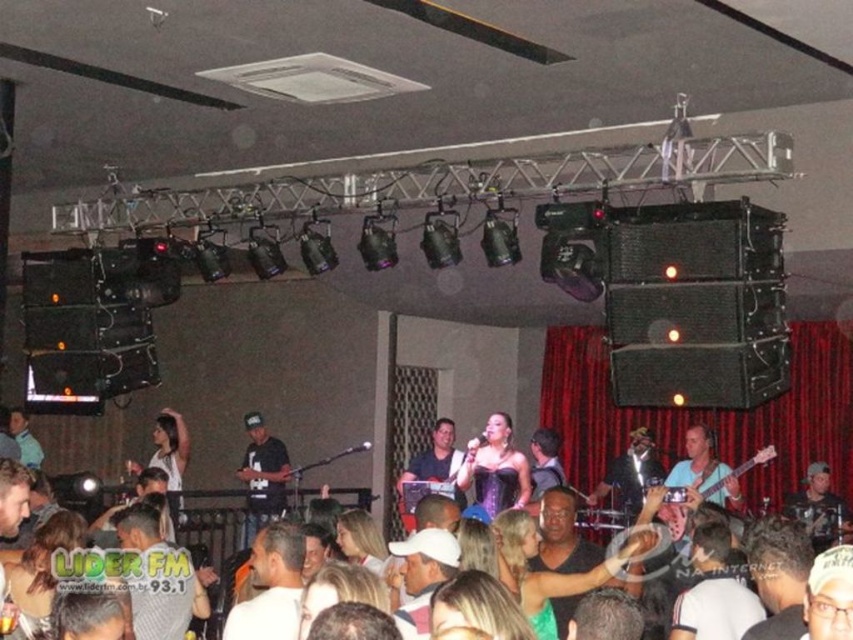
Is point (260, 614) less distant than point (283, 458)?

Yes, it is in front of point (283, 458).

Is white matte shirt at center to the right of black matte shirt at center from the viewer's perspective?

Indeed, white matte shirt at center is positioned on the right side of black matte shirt at center.

Between point (274, 556) and point (277, 472), which one is positioned behind?

The point (277, 472) is more distant.

I want to click on white matte shirt at center, so click(x=271, y=586).

Does purple satin dress at center appear on the left side of matte black guitar at center?

In fact, purple satin dress at center is to the right of matte black guitar at center.

Can you confirm if purple satin dress at center is thinner than matte black guitar at center?

No.

Measure the distance between point (509, 476) and camera.

A distance of 7.76 meters exists between point (509, 476) and camera.

Find the location of a particular element. This screenshot has height=640, width=853. purple satin dress at center is located at coordinates (495, 468).

Who is taller, white matte shirt at center or matte black guitar at center?

matte black guitar at center is taller.

Which is behind, point (259, 605) or point (459, 458)?

Positioned behind is point (459, 458).

Between point (230, 611) and point (444, 477), which one is positioned behind?

Positioned behind is point (444, 477).

Where is `white matte shirt at center`? white matte shirt at center is located at coordinates (271, 586).